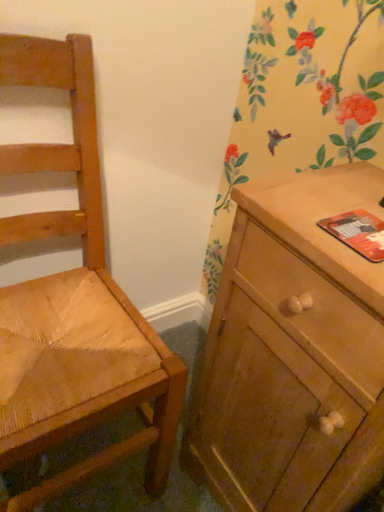
Question: Looking at their shapes, would you say light brown woven wood chair at left is wider or thinner than wooden cabinet at right?

Choices:
 (A) wide
 (B) thin

Answer: (A)

Question: Does point (34, 353) appear closer or farther from the camera than point (359, 305)?

Choices:
 (A) farther
 (B) closer

Answer: (A)

Question: Which of these objects is positioned closest to the light brown woven wood chair at left?

Choices:
 (A) orange matte paperback book at right
 (B) wooden cabinet at right

Answer: (B)

Question: Which of these objects is positioned closest to the light brown woven wood chair at left?

Choices:
 (A) wooden cabinet at right
 (B) orange matte paperback book at right

Answer: (A)